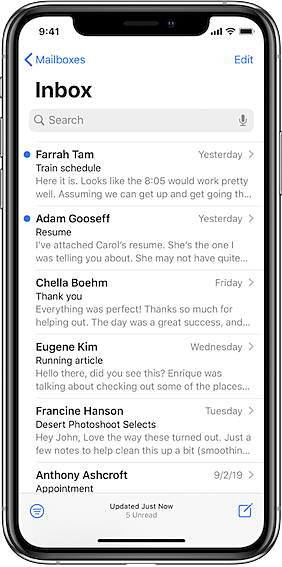
The height and width of the screenshot is (567, 282). I want to click on phone buttons, so (1, 90), (1, 134), (0, 175), (279, 165).